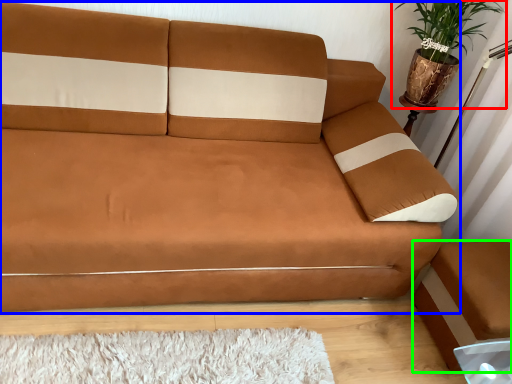
Question: Which is nearer to the houseplant (highlighted by a red box)? studio couch (highlighted by a blue box) or footrest (highlighted by a green box).

Choices:
 (A) studio couch
 (B) footrest

Answer: (A)